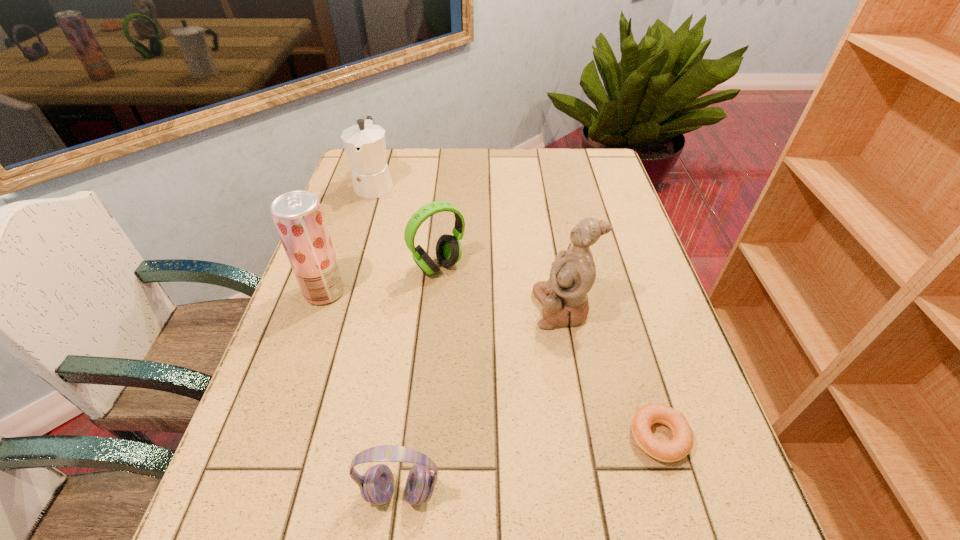
At what (x,y) coordinates should I click in order to perform the action: click on fruit juice. Please return your answer as a coordinate pair (x, y). The width and height of the screenshot is (960, 540). Looking at the image, I should click on (298, 217).

Where is `figurine`? figurine is located at coordinates (564, 298).

Find the location of `the farthest object`. the farthest object is located at coordinates (365, 145).

At what (x,y) coordinates should I click in order to perform the action: click on the taller headset. Please return your answer as a coordinate pair (x, y). The height and width of the screenshot is (540, 960). Looking at the image, I should click on (448, 248).

At what (x,y) coordinates should I click in order to perform the action: click on the farther headset. Please return your answer as a coordinate pair (x, y). This screenshot has height=540, width=960. Looking at the image, I should click on (448, 248).

I want to click on the shorter headset, so click(376, 486).

Image resolution: width=960 pixels, height=540 pixels. Identify the location of the nearest object. (376, 486).

Identify the location of bagel. (680, 446).

Locate an element on the screen. the second nearest object is located at coordinates (680, 446).

Locate an element on the screen. The image size is (960, 540). vacant space located on the front of the fruit juice is located at coordinates (308, 340).